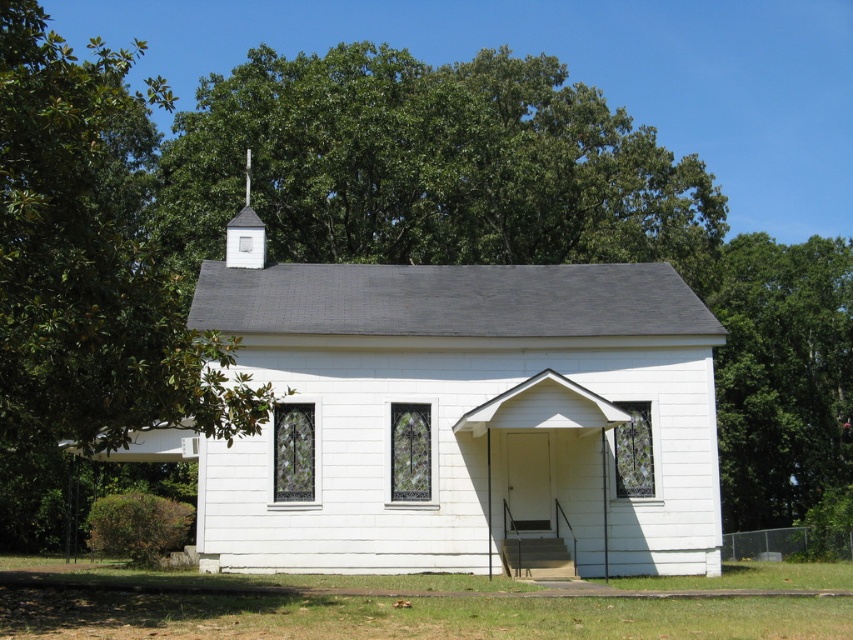
Question: Which is farther from the green leafy tree at upper right?

Choices:
 (A) green leafy tree at upper left
 (B) white wood chapel at center

Answer: (A)

Question: Is white wood chapel at center closer to the viewer compared to green leafy tree at upper right?

Choices:
 (A) yes
 (B) no

Answer: (A)

Question: Where is green leafy tree at upper left located in relation to green leafy tree at upper right in the image?

Choices:
 (A) left
 (B) right

Answer: (A)

Question: Which of the following is the farthest from the observer?

Choices:
 (A) (782, 305)
 (B) (364, 291)

Answer: (A)

Question: Which point is closer to the camera?

Choices:
 (A) (418, 545)
 (B) (729, 529)

Answer: (A)

Question: Does green leafy tree at upper left have a lesser width compared to green leafy tree at upper right?

Choices:
 (A) no
 (B) yes

Answer: (B)